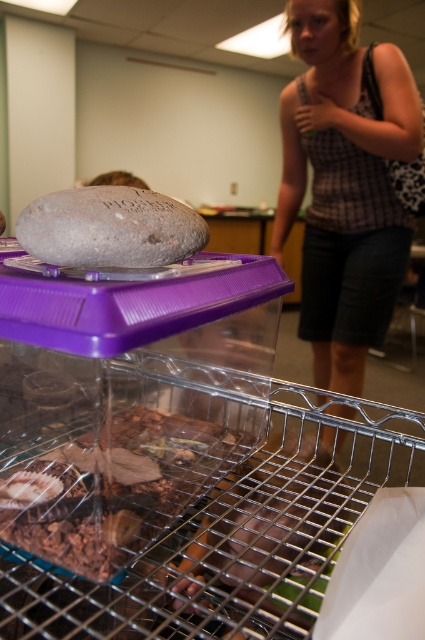
Question: Which object is farther from the camera taking this photo?

Choices:
 (A) gray matte rock at upper left
 (B) plaid fabric tank top at upper right
 (C) brown textured wood at center

Answer: (B)

Question: Is the position of plaid fabric tank top at upper right less distant than that of brown textured wood at center?

Choices:
 (A) no
 (B) yes

Answer: (A)

Question: Does brown textured wood at center appear under gray matte rock at upper left?

Choices:
 (A) no
 (B) yes

Answer: (B)

Question: Is brown textured wood at center positioned in front of gray matte rock at upper left?

Choices:
 (A) yes
 (B) no

Answer: (B)

Question: Which of the following is the farthest from the observer?

Choices:
 (A) (302, 326)
 (B) (28, 241)

Answer: (A)

Question: Which object appears closest to the camera in this image?

Choices:
 (A) brown textured wood at center
 (B) gray matte rock at upper left

Answer: (B)